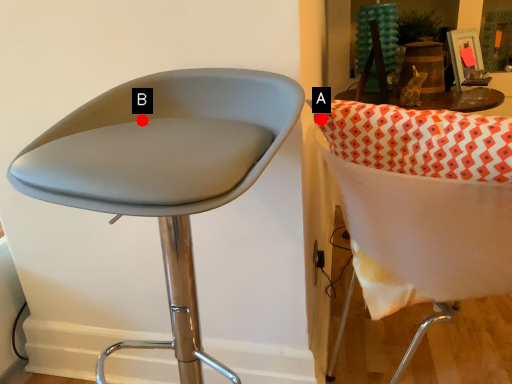
Question: Two points are circled on the image, labeled by A and B beside each circle. Which point is further to the camera?

Choices:
 (A) A is further
 (B) B is further

Answer: (B)